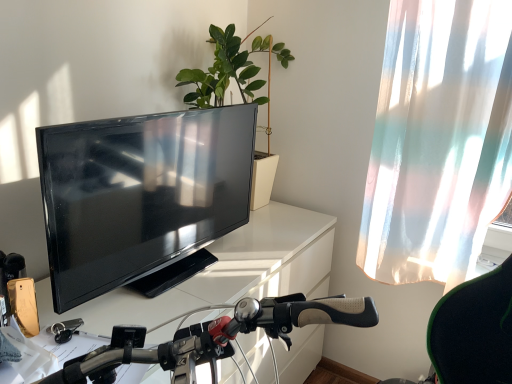
Identify the location of vacant area that is situated to the right of green matte plant at upper center. (284, 216).